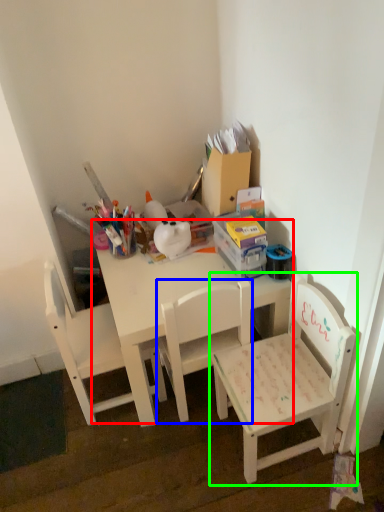
Question: Estimate the real-world distances between objects in this image. Which object is farther from table (highlighted by a red box), chair (highlighted by a blue box) or chair (highlighted by a green box)?

Choices:
 (A) chair
 (B) chair

Answer: (B)